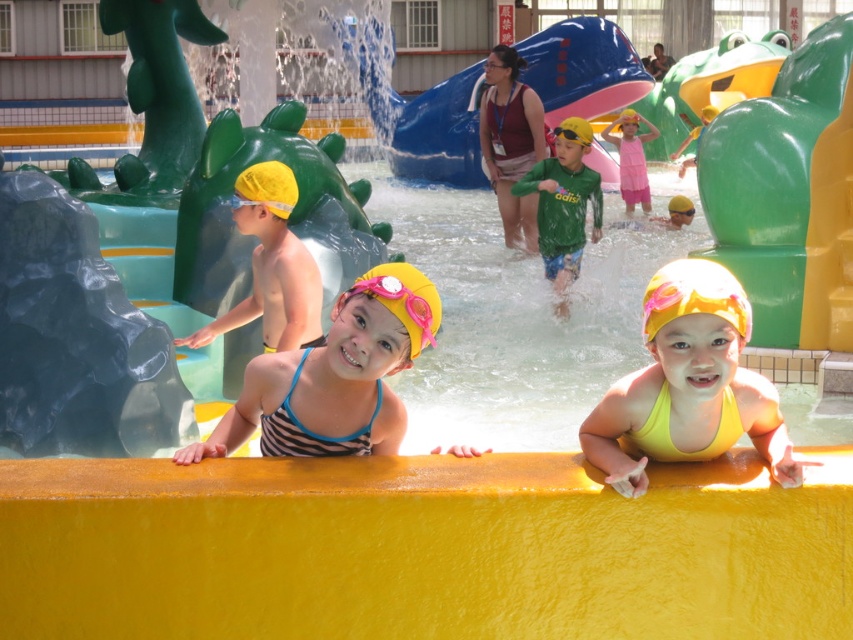
You are a lifeguard at the water park and need to ensure that the striped fabric swimsuit at center and the pink fabric dress at upper center are within the designated safety zone. Based on their positions, which one is more likely to be closer to the edge of the safety zone?

The striped fabric swimsuit at center is wider than the pink fabric dress at upper center, so it might be closer to the edge of the safety zone.

From the picture: You are a photographer at the water park and want to capture a photo of both the green matte shirt at center and the pink fabric dress at upper center. Which object should you focus on first if you want to include both in your shot without moving the camera?

The green matte shirt at center is to the left of the pink fabric dress at upper center, so you should focus on the green matte shirt at center first to ensure both are in frame.